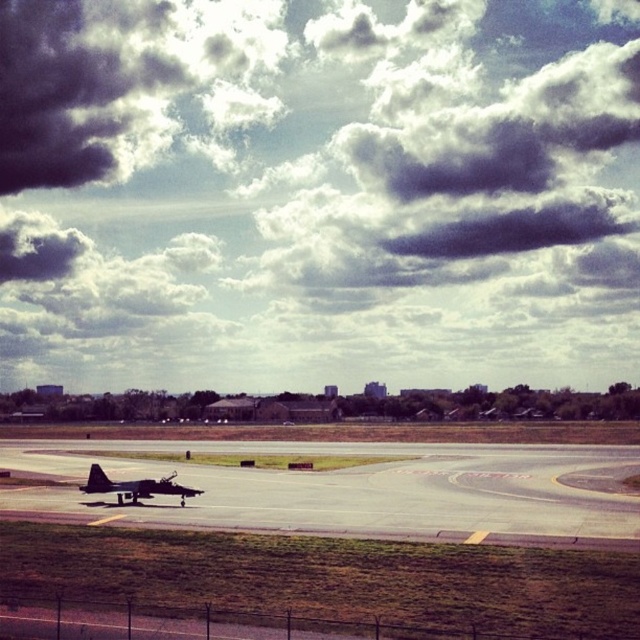
You are a pilot preparing for takeoff and need to check the distance between the dark gray cloud at upper center and the shiny black jet at center. Is the cloud within a safe distance for takeoff? Assume safe distance is 100 meters.

The dark gray cloud at upper center is 109.48 meters from the shiny black jet at center. Since this distance exceeds the safe 100 meters, the cloud is outside the safe distance for takeoff.

You are a pilot preparing for takeoff and notice the dark gray cloud at upper center and the smooth asphalt runway at lower center. Which object is positioned higher in the sky?

The dark gray cloud at upper center is positioned higher in the sky than the smooth asphalt runway at lower center.

You are standing at the edge of the runway and see two points marked on the airfield. The first point is at coordinate point (538, 472) and the second is at point (102, 476). Which point is closer to your current position?

Point (102, 476) is closer to your current position because it is nearer to the camera compared to point (538, 472), which is further away.